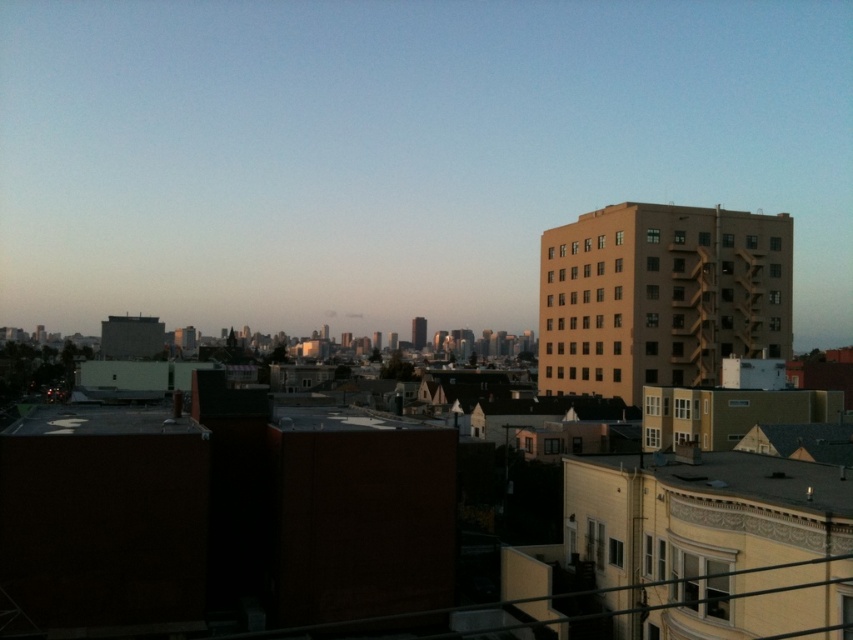
Question: Is matte brown building at right above beige concrete building at upper right?

Choices:
 (A) yes
 (B) no

Answer: (A)

Question: Which point is closer to the camera taking this photo?

Choices:
 (A) pyautogui.click(x=260, y=202)
 (B) pyautogui.click(x=643, y=337)

Answer: (B)

Question: Which point is farther from the camera taking this photo?

Choices:
 (A) (460, 61)
 (B) (634, 371)

Answer: (A)

Question: Does matte brown building at right have a larger size compared to beige concrete building at upper right?

Choices:
 (A) no
 (B) yes

Answer: (B)

Question: Is matte brown building at right to the left of beige concrete building at upper right from the viewer's perspective?

Choices:
 (A) no
 (B) yes

Answer: (B)